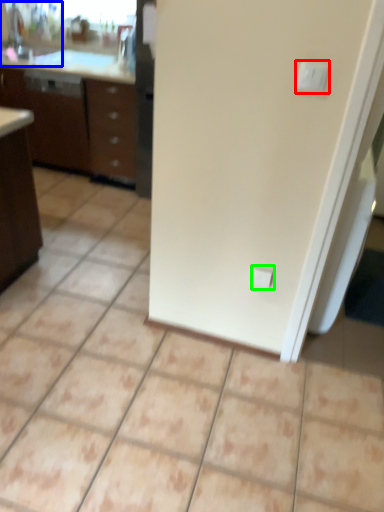
Question: Considering the real-world distances, which object is farthest from light switch (highlighted by a red box)? sink (highlighted by a blue box) or electric outlet (highlighted by a green box)?

Choices:
 (A) sink
 (B) electric outlet

Answer: (A)